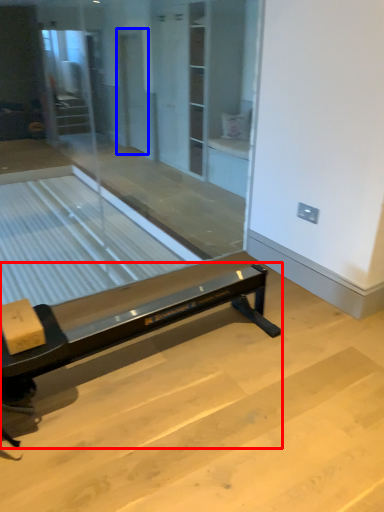
Question: Which point is closer to the camera, furniture (highlighted by a red box) or screen door (highlighted by a blue box)?

Choices:
 (A) furniture
 (B) screen door

Answer: (A)